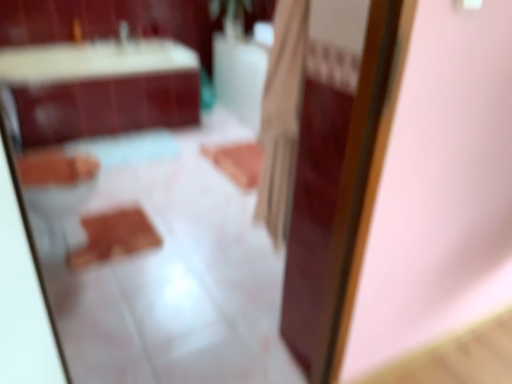
What do you see at coordinates (281, 118) in the screenshot? The image size is (512, 384). I see `beige fabric curtain at center` at bounding box center [281, 118].

At what (x,y) coordinates should I click in order to perform the action: click on beige fabric curtain at center. Please return your answer as a coordinate pair (x, y). The image size is (512, 384). Looking at the image, I should click on (281, 118).

The image size is (512, 384). Identify the location of beige fabric curtain at center. (281, 118).